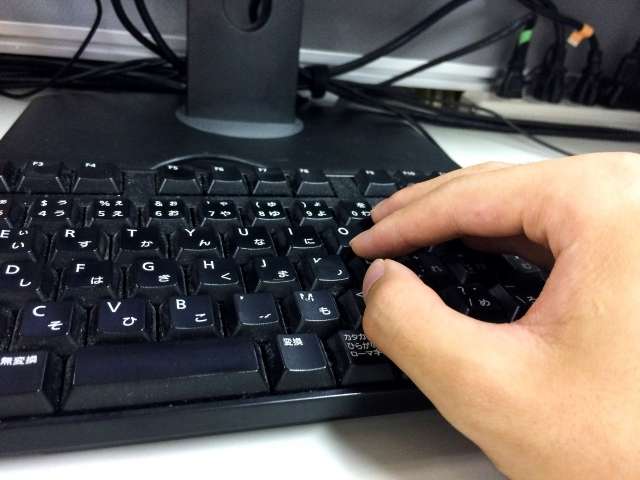
Find the location of `monitor stand`. monitor stand is located at coordinates (258, 87).